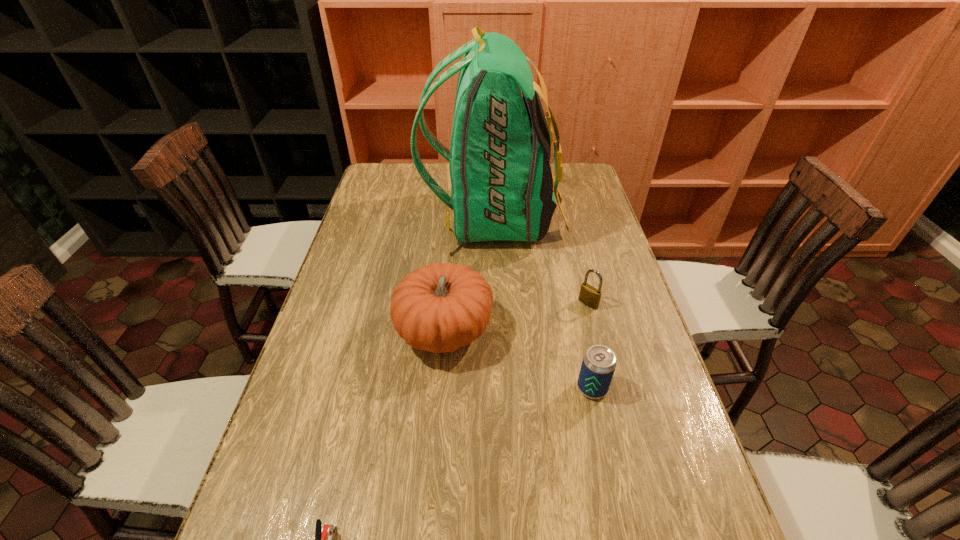
The width and height of the screenshot is (960, 540). Identify the location of free space that satisfies the following two spatial constraints: 1. on the front side of the second nearest object; 2. on the right side of the pumpkin. (440, 388).